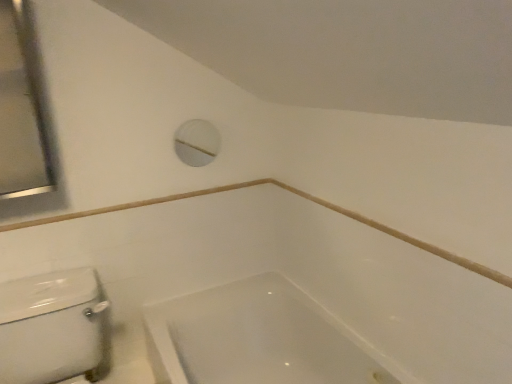
The height and width of the screenshot is (384, 512). I want to click on satin silver mirror at upper left, so click(20, 111).

Is white glossy bathtub at lower center outside of white glossy porcelain at lower left?

Absolutely, white glossy bathtub at lower center is external to white glossy porcelain at lower left.

Can you confirm if white glossy bathtub at lower center is positioned to the left of white glossy porcelain at lower left?

Incorrect, white glossy bathtub at lower center is not on the left side of white glossy porcelain at lower left.

Between white glossy bathtub at lower center and white glossy porcelain at lower left, which one has larger width?

white glossy porcelain at lower left.

Is white glossy bathtub at lower center positioned far away from white glossy porcelain at lower left?

That's not correct — white glossy bathtub at lower center is a little close to white glossy porcelain at lower left.

From a real-world perspective, is white glossy bathtub at lower center on satin silver mirror at upper left?

No, from a real-world perspective, white glossy bathtub at lower center is not over satin silver mirror at upper left

Looking at this image, how different are the orientations of white glossy bathtub at lower center and satin silver mirror at upper left in degrees?

The angle between the facing direction of white glossy bathtub at lower center and the facing direction of satin silver mirror at upper left is 89.5 degrees.

Is point (276, 293) closer to viewer compared to point (6, 176)?

No, (276, 293) is further to viewer.

Can you confirm if white glossy bathtub at lower center is bigger than satin silver mirror at upper left?

Yes, white glossy bathtub at lower center is bigger than satin silver mirror at upper left.

Is satin silver mirror at upper left placed right next to white plastic porthole at upper center?

No, satin silver mirror at upper left is not next to white plastic porthole at upper center.

The width and height of the screenshot is (512, 384). Identify the location of mirror above the white plastic porthole at upper center (from the image's perspective). (20, 111).

Is satin silver mirror at upper left in front of or behind white plastic porthole at upper center in the image?

In the image, satin silver mirror at upper left appears in front of white plastic porthole at upper center.

From a real-world perspective, does satin silver mirror at upper left stand above white glossy bathtub at lower center?

Yes, from a real-world perspective, satin silver mirror at upper left is on top of white glossy bathtub at lower center.

What's the angular difference between satin silver mirror at upper left and white glossy bathtub at lower center's facing directions?

The angle between the facing direction of satin silver mirror at upper left and the facing direction of white glossy bathtub at lower center is 89.5 degrees.

From the picture: Which object is thinner, satin silver mirror at upper left or white glossy bathtub at lower center?

satin silver mirror at upper left is thinner.

Does satin silver mirror at upper left appear on the right side of white glossy bathtub at lower center?

In fact, satin silver mirror at upper left is to the left of white glossy bathtub at lower center.

Consider the image. Would you say white glossy porcelain at lower left contains white glossy bathtub at lower center?

No, white glossy bathtub at lower center is not a part of white glossy porcelain at lower left.

Is white glossy porcelain at lower left facing towards white glossy bathtub at lower center?

No, white glossy porcelain at lower left is not aimed at white glossy bathtub at lower center.

How many degrees apart are the facing directions of white glossy porcelain at lower left and white glossy bathtub at lower center?

88.9 degrees separate the facing orientations of white glossy porcelain at lower left and white glossy bathtub at lower center.

Considering the relative positions of white glossy porcelain at lower left and white glossy bathtub at lower center in the image provided, is white glossy porcelain at lower left to the left of white glossy bathtub at lower center from the viewer's perspective?

Correct, you'll find white glossy porcelain at lower left to the left of white glossy bathtub at lower center.

Would you consider satin silver mirror at upper left to be distant from white glossy porcelain at lower left?

No.

Based on the photo, how distant is satin silver mirror at upper left from white glossy porcelain at lower left?

satin silver mirror at upper left and white glossy porcelain at lower left are 21.44 inches apart.

Is the depth of satin silver mirror at upper left less than that of white glossy porcelain at lower left?

No, satin silver mirror at upper left is further to the viewer.

From the image's perspective, is satin silver mirror at upper left positioned above or below white glossy porcelain at lower left?

Based on their image positions, satin silver mirror at upper left is located above white glossy porcelain at lower left.

From a real-world perspective, is white plastic porthole at upper center physically below satin silver mirror at upper left?

Yes.

Is white plastic porthole at upper center located outside satin silver mirror at upper left?

white plastic porthole at upper center lies outside satin silver mirror at upper left's area.

This screenshot has width=512, height=384. Identify the location of porthole that appears below the satin silver mirror at upper left (from the image's perspective). (197, 142).

Which is in front, white plastic porthole at upper center or satin silver mirror at upper left?

satin silver mirror at upper left is more forward.

Locate an element on the screen. bathtub behind the white glossy porcelain at lower left is located at coordinates (303, 341).

The image size is (512, 384). I want to click on mirror lying above the white glossy bathtub at lower center (from the image's perspective), so click(20, 111).

Estimate the real-world distances between objects in this image. Which object is closer to white plastic porthole at upper center, white glossy bathtub at lower center or white glossy porcelain at lower left?

white glossy bathtub at lower center is positioned closer to the anchor white plastic porthole at upper center.

Considering their positions, is white glossy porcelain at lower left positioned further to white glossy bathtub at lower center than satin silver mirror at upper left?

satin silver mirror at upper left lies further to white glossy bathtub at lower center than the other object.

Based on their spatial positions, is satin silver mirror at upper left or white glossy porcelain at lower left closer to white glossy bathtub at lower center?

Based on the image, white glossy porcelain at lower left appears to be nearer to white glossy bathtub at lower center.

From the picture: From the image, which object appears to be farther from satin silver mirror at upper left, white plastic porthole at upper center or white glossy porcelain at lower left?

white plastic porthole at upper center.

Based on their spatial positions, is white plastic porthole at upper center or satin silver mirror at upper left closer to white glossy porcelain at lower left?

satin silver mirror at upper left lies closer to white glossy porcelain at lower left than the other object.

Based on their spatial positions, is satin silver mirror at upper left or white glossy bathtub at lower center further from white glossy porcelain at lower left?

satin silver mirror at upper left.

Based on their spatial positions, is white glossy bathtub at lower center or satin silver mirror at upper left closer to white glossy porcelain at lower left?

white glossy bathtub at lower center is closer to white glossy porcelain at lower left.

When comparing their distances from satin silver mirror at upper left, does white glossy bathtub at lower center or white glossy porcelain at lower left seem further?

white glossy bathtub at lower center is positioned further to the anchor satin silver mirror at upper left.

Image resolution: width=512 pixels, height=384 pixels. Identify the location of porcelain between satin silver mirror at upper left and white glossy bathtub at lower center from top to bottom. (50, 326).

This screenshot has height=384, width=512. In order to click on porthole between satin silver mirror at upper left and white glossy bathtub at lower center from top to bottom in this screenshot , I will do `click(197, 142)`.

The image size is (512, 384). In order to click on porcelain between white plastic porthole at upper center and white glossy bathtub at lower center vertically in this screenshot , I will do `click(50, 326)`.

Image resolution: width=512 pixels, height=384 pixels. I want to click on porthole between satin silver mirror at upper left and white glossy porcelain at lower left from top to bottom, so click(197, 142).